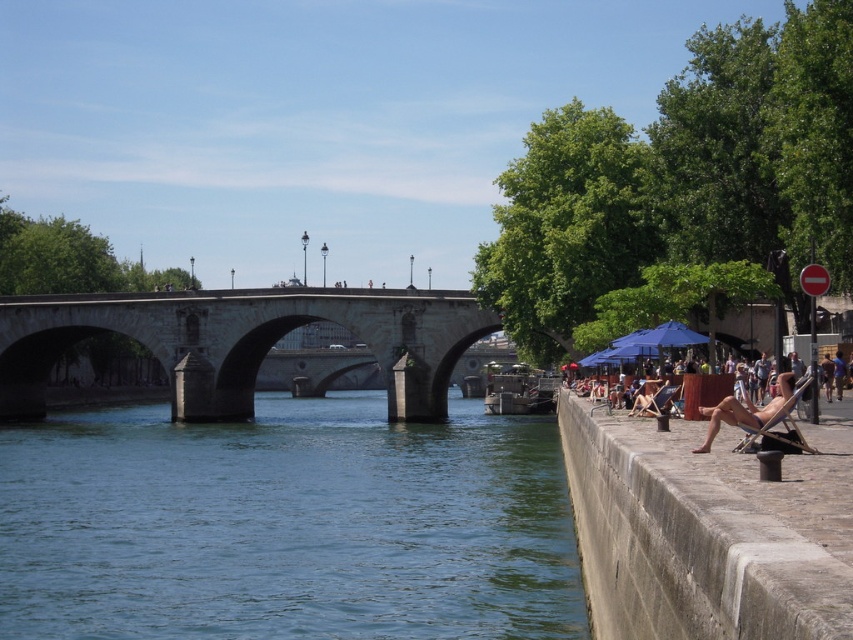
Who is lower down, green water at lower left or concrete at right?

green water at lower left

Between green water at lower left and concrete at right, which one appears on the left side from the viewer's perspective?

green water at lower left is more to the left.

Who is more forward, (189, 554) or (822, 612)?

Point (822, 612)

Locate an element on the screen. This screenshot has width=853, height=640. green water at lower left is located at coordinates (287, 525).

How much distance is there between green water at lower left and brown leather chair at right?

green water at lower left is 119.92 feet from brown leather chair at right.

Who is positioned more to the right, green water at lower left or brown leather chair at right?

From the viewer's perspective, brown leather chair at right appears more on the right side.

Is point (404, 579) behind point (836, 388)?

No.

Where is `green water at lower left`? This screenshot has width=853, height=640. green water at lower left is located at coordinates (287, 525).

Can you confirm if stone bridge at center is shorter than tan skin person at right?

Incorrect, stone bridge at center's height does not fall short of tan skin person at right's.

Does stone bridge at center appear over tan skin person at right?

No.

Where is `stone bridge at center`? stone bridge at center is located at coordinates (242, 340).